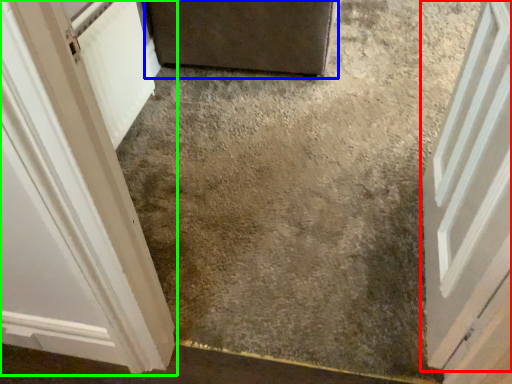
Question: Estimate the real-world distances between objects in this image. Which object is closer to door (highlighted by a red box), door (highlighted by a blue box) or door (highlighted by a green box)?

Choices:
 (A) door
 (B) door

Answer: (B)